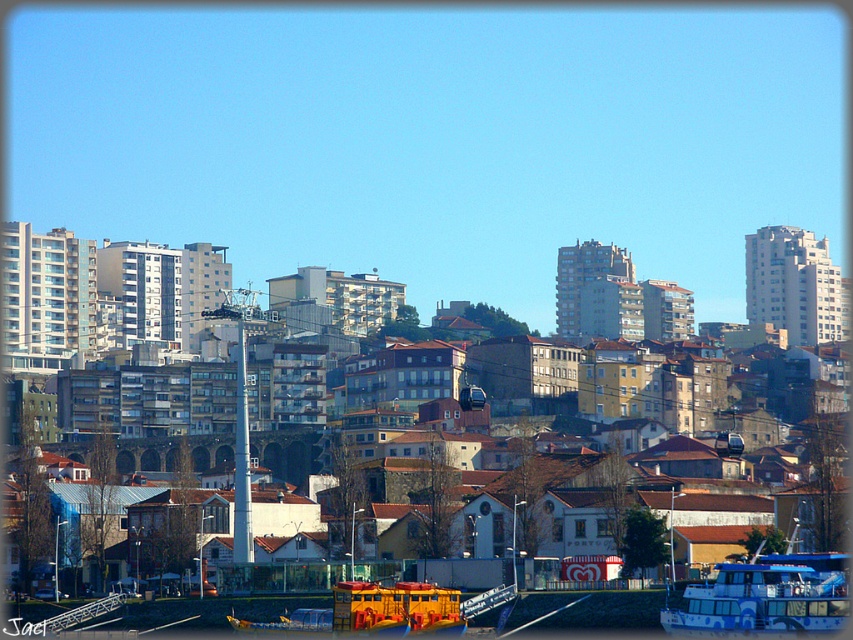
Question: Observing the image, what is the correct spatial positioning of blue glossy boat at lower right in reference to yellow matte boat at lower center?

Choices:
 (A) above
 (B) below

Answer: (A)

Question: Which point is farther to the camera?

Choices:
 (A) blue glossy boat at lower right
 (B) yellow matte boat at lower center

Answer: (B)

Question: Is blue glossy boat at lower right bigger than yellow matte boat at lower center?

Choices:
 (A) no
 (B) yes

Answer: (A)

Question: Which point is closer to the camera?

Choices:
 (A) blue glossy boat at lower right
 (B) yellow matte boat at lower center

Answer: (A)

Question: Does blue glossy boat at lower right have a larger size compared to yellow matte boat at lower center?

Choices:
 (A) no
 (B) yes

Answer: (A)